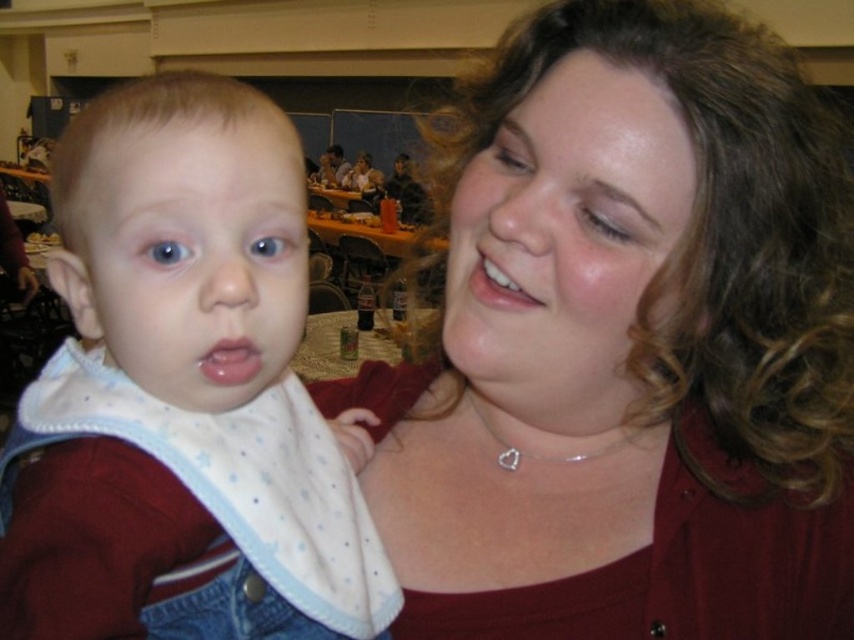
Between matte red shirt at center and white dotted bib at left, which one is positioned higher?

Positioned higher is matte red shirt at center.

Is matte red shirt at center shorter than white dotted bib at left?

No.

Which is behind, point (586, 280) or point (297, 605)?

Point (297, 605)

You are a GUI agent. You are given a task and a screenshot of the screen. Output one action in this format:
    pyautogui.click(x=<x>, y=<y>)
    Task: Click on the matte red shirt at center
    The width and height of the screenshot is (854, 640).
    Given the screenshot: What is the action you would take?
    pyautogui.click(x=627, y=344)